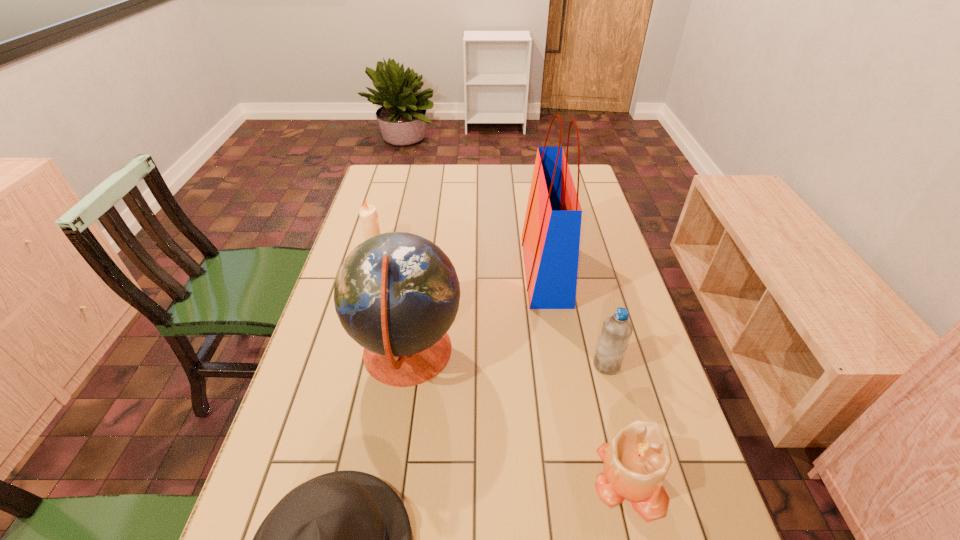
Locate an element on the screen. The height and width of the screenshot is (540, 960). vacant region between the shopping bag and the fifth shortest object is located at coordinates (476, 312).

Find the location of a particular element. The width and height of the screenshot is (960, 540). unoccupied position between the left candle and the nearer candle is located at coordinates (501, 362).

You are a GUI agent. You are given a task and a screenshot of the screen. Output one action in this format:
    pyautogui.click(x=<x>, y=<y>)
    Task: Click on the empty space between the shopping bag and the left candle
    The width and height of the screenshot is (960, 540).
    Given the screenshot: What is the action you would take?
    pyautogui.click(x=460, y=258)

This screenshot has width=960, height=540. What are the coordinates of `free space between the tallest object and the right candle` in the screenshot? It's located at (587, 375).

Identify which object is located as the fifth nearest to the water bottle. Please provide its 2D coordinates. Your answer should be formatted as a tuple, i.e. [(x, y)], where the tuple contains the x and y coordinates of a point satisfying the conditions above.

[(368, 214)]

The width and height of the screenshot is (960, 540). I want to click on the closest object relative to the right candle, so click(x=616, y=331).

Locate an element on the screen. This screenshot has height=540, width=960. vacant space that satisfies the following two spatial constraints: 1. on the handle side of the water bottle; 2. on the left side of the tallest object is located at coordinates (562, 365).

You are a GUI agent. You are given a task and a screenshot of the screen. Output one action in this format:
    pyautogui.click(x=<x>, y=<y>)
    Task: Click on the blank area in the image that satisfies the following two spatial constraints: 1. on the handle side of the shopping bag; 2. on the right side of the water bottle
    
    Given the screenshot: What is the action you would take?
    pyautogui.click(x=562, y=365)

The height and width of the screenshot is (540, 960). I want to click on free spot that satisfies the following two spatial constraints: 1. on the handle side of the water bottle; 2. on the left side of the shopping bag, so click(x=562, y=365).

Locate an element on the screen. free space in the image that satisfies the following two spatial constraints: 1. on the handle side of the water bottle; 2. on the right side of the tallest object is located at coordinates (562, 365).